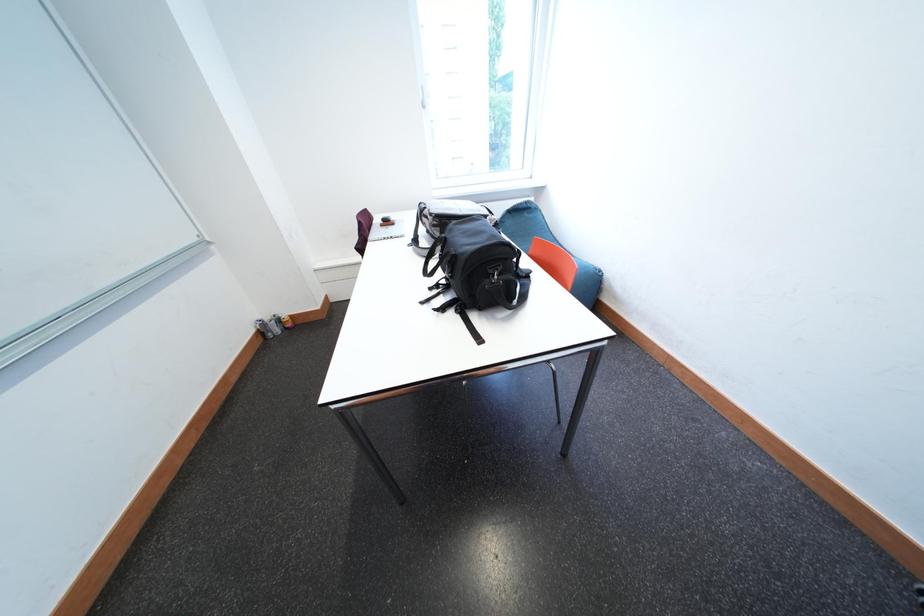
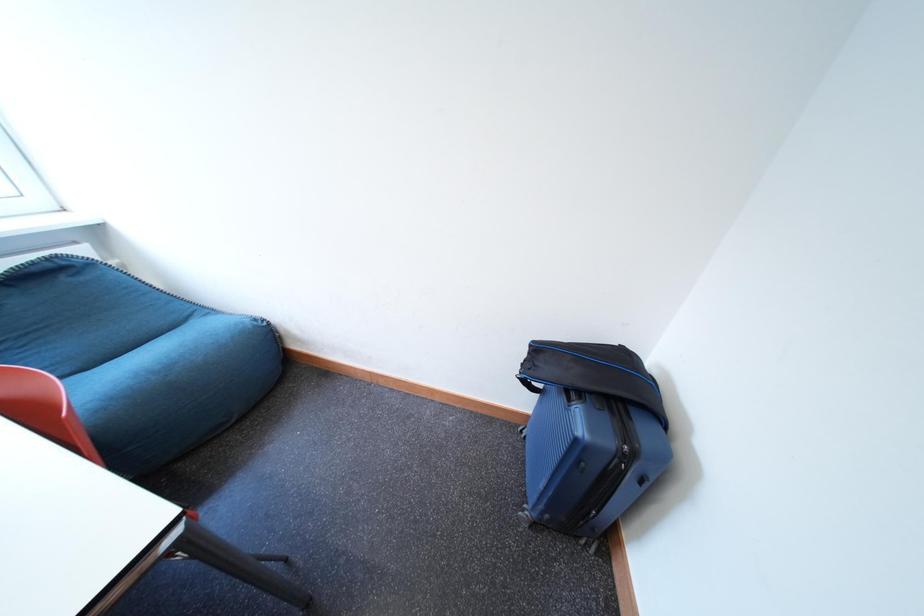
Question: The first image is from the beginning of the video and the second image is from the end. How did the camera likely rotate when shooting the video?

Choices:
 (A) Left
 (B) Right
 (C) Up
 (D) Down

Answer: (B)